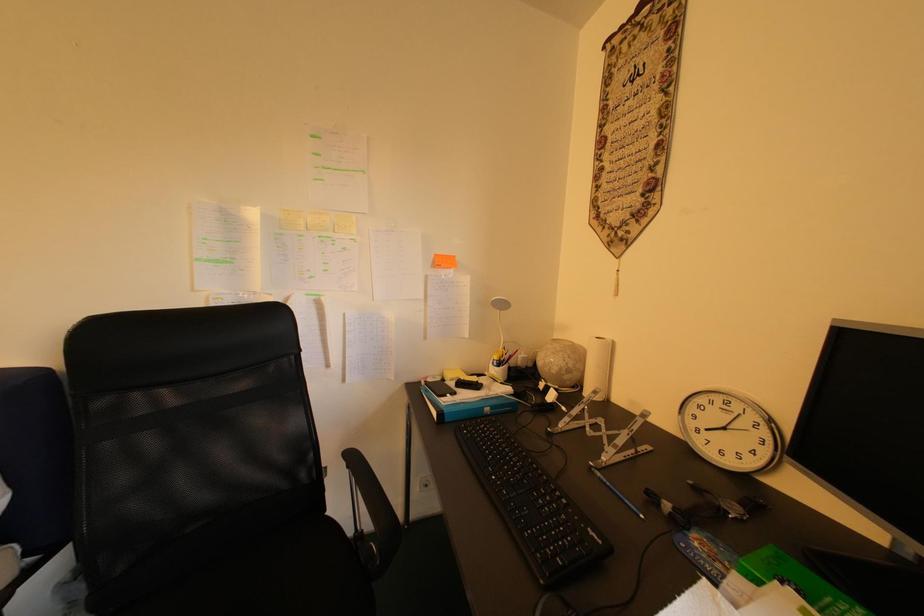
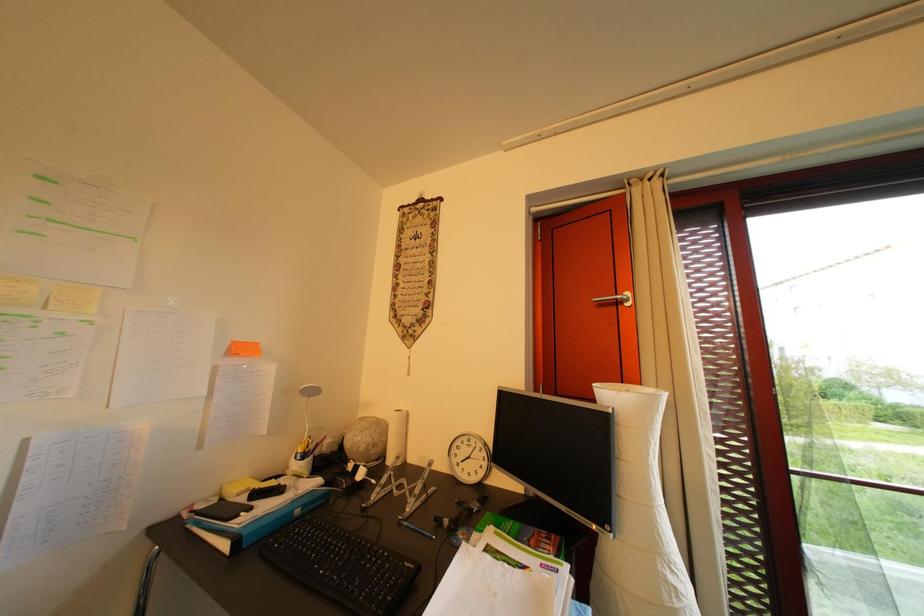
Question: The camera is either moving clockwise (left) or counter-clockwise (right) around the object. The first image is from the beginning of the video and the second image is from the end. Is the camera moving left or right when shooting the video?

Choices:
 (A) Left
 (B) Right

Answer: (A)